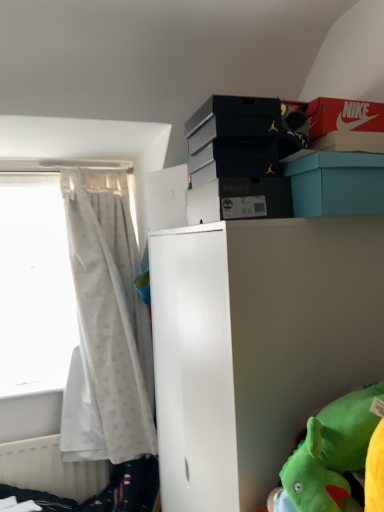
Question: Is black matte shoebox at upper center, which appears as the 5th storage box when viewed from the top, beside black matte shoebox at upper center, arranged as the 3th storage box when viewed from the top?

Choices:
 (A) yes
 (B) no

Answer: (A)

Question: Does black matte shoebox at upper center, which appears as the 5th storage box when viewed from the top, have a lesser width compared to black matte shoebox at upper center, arranged as the 3th storage box when viewed from the top?

Choices:
 (A) yes
 (B) no

Answer: (B)

Question: Is black matte shoebox at upper center, acting as the 1th storage box starting from the bottom, not near black matte shoebox at upper center, which appears as the third storage box when ordered from the bottom?

Choices:
 (A) no
 (B) yes

Answer: (A)

Question: From the image's perspective, does black matte shoebox at upper center, acting as the 1th storage box starting from the bottom, appear lower than black matte shoebox at upper center, which appears as the third storage box when ordered from the bottom?

Choices:
 (A) no
 (B) yes

Answer: (B)

Question: From a real-world perspective, is black matte shoebox at upper center, which appears as the 5th storage box when viewed from the top, beneath black matte shoebox at upper center, which appears as the third storage box when ordered from the bottom?

Choices:
 (A) yes
 (B) no

Answer: (A)

Question: From a real-world perspective, does black matte shoebox at upper center, which appears as the 5th storage box when viewed from the top, stand above black matte shoebox at upper center, which appears as the third storage box when ordered from the bottom?

Choices:
 (A) no
 (B) yes

Answer: (A)

Question: Considering the relative positions of white sheer curtain at left and teal cardboard box at upper center, which appears as the second storage box when ordered from the bottom, in the image provided, is white sheer curtain at left to the right of teal cardboard box at upper center, which appears as the second storage box when ordered from the bottom, from the viewer's perspective?

Choices:
 (A) no
 (B) yes

Answer: (A)

Question: Is white sheer curtain at left thinner than teal cardboard box at upper center, which appears as the second storage box when ordered from the bottom?

Choices:
 (A) yes
 (B) no

Answer: (A)

Question: From a real-world perspective, is white sheer curtain at left beneath teal cardboard box at upper center, the fourth storage box viewed from the top?

Choices:
 (A) yes
 (B) no

Answer: (A)

Question: From a real-world perspective, is white sheer curtain at left over teal cardboard box at upper center, which appears as the second storage box when ordered from the bottom?

Choices:
 (A) no
 (B) yes

Answer: (A)

Question: Can you confirm if white sheer curtain at left is shorter than teal cardboard box at upper center, the fourth storage box viewed from the top?

Choices:
 (A) no
 (B) yes

Answer: (A)

Question: From the image's perspective, is white sheer curtain at left beneath teal cardboard box at upper center, which appears as the second storage box when ordered from the bottom?

Choices:
 (A) yes
 (B) no

Answer: (A)